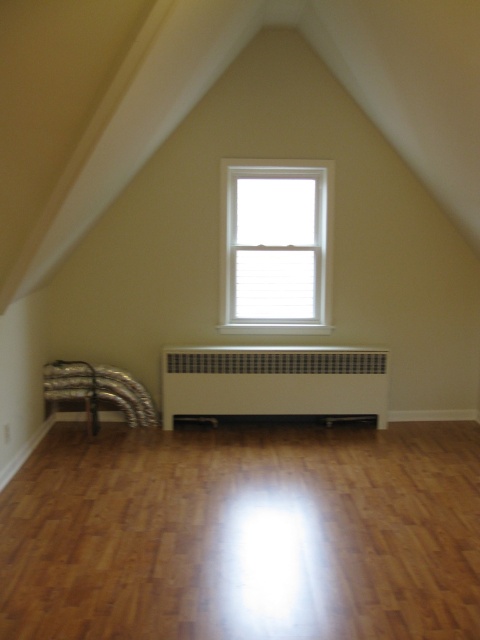
You are standing in the center of the room. Where exactly is the light brown wood floor at center located?

The light brown wood floor at center is located at point (244,532).